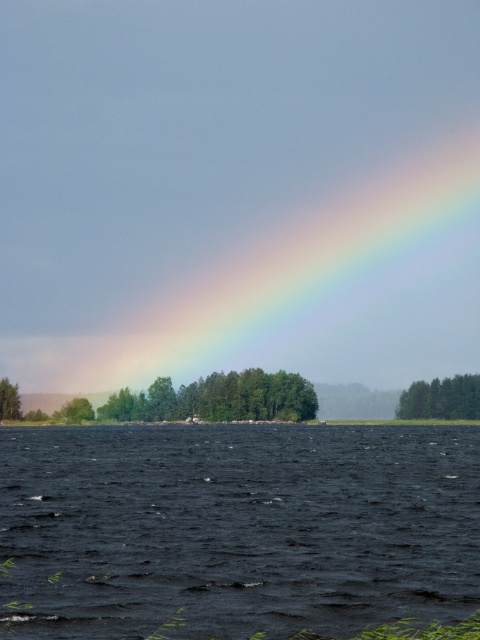
What is located at the coordinates point (218, 397) in the image?

The coordinates point (218, 397) indicate the location of green leafy trees at center.

You are standing on the shore looking at the dark blue water at center. Which direction should you face to see the rainbow above the water?

The rainbow is positioned relative to the sun, so if you are facing the dark blue water at center, you should turn to face away from the sun to see the rainbow above the water.